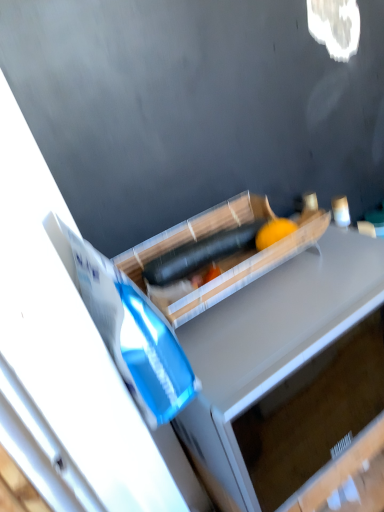
Identify the location of wooden tray at center. The height and width of the screenshot is (512, 384). (222, 258).

What is the approximate height of wooden tray at center?

wooden tray at center is 3.68 inches in height.

Describe the element at coordinates (222, 258) in the screenshot. I see `wooden tray at center` at that location.

In order to face wooden tray at center, should I rotate leftwards or rightwards?

To align with it, rotate right about 3.556°.

What are the coordinates of `wooden tray at center` in the screenshot? It's located at [x=222, y=258].